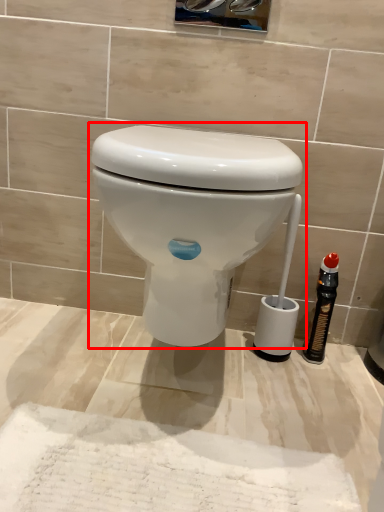
Question: From the image's perspective, what is the correct spatial relationship of toilet (annotated by the red box) in relation to bottle?

Choices:
 (A) above
 (B) below

Answer: (A)